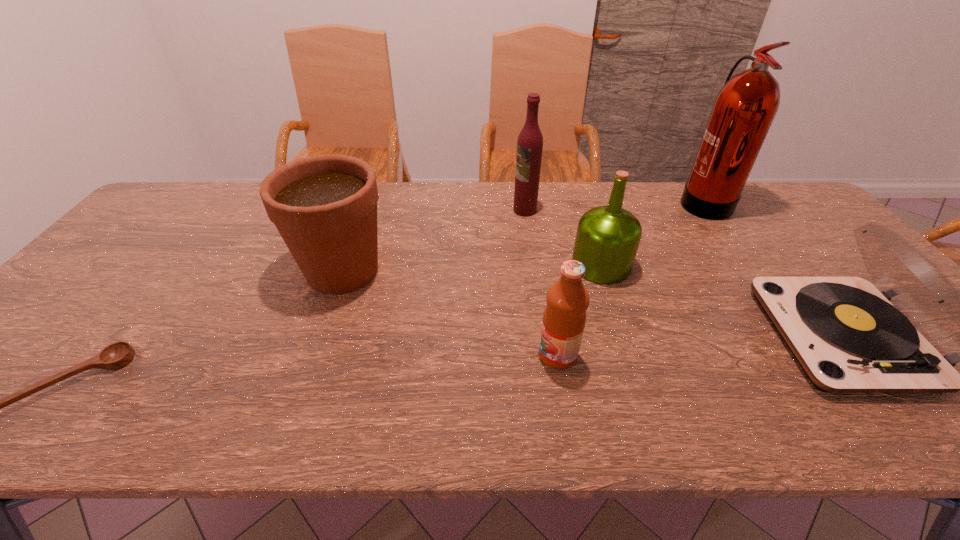
Locate an element on the screen. The width and height of the screenshot is (960, 540). free space at the left edge of the desktop is located at coordinates (20, 360).

In the image, there is a desktop. Where is `vacant space at the far right corner`? vacant space at the far right corner is located at coordinates (786, 191).

This screenshot has height=540, width=960. In order to click on blank region between the fruit juice and the sixth shortest object in this screenshot , I will do `click(541, 283)`.

I want to click on free area in between the fire extinguisher and the third object from right to left, so click(652, 233).

The height and width of the screenshot is (540, 960). Find the location of `the second closest object to the olive oil`. the second closest object to the olive oil is located at coordinates (564, 318).

Identify the location of object that is the sixth closest to the leftmost object. (744, 109).

Identify the location of free location that satisfies the following two spatial constraints: 1. on the back side of the fifth object from left to right; 2. on the label of the second tallest object. This screenshot has width=960, height=540. (584, 210).